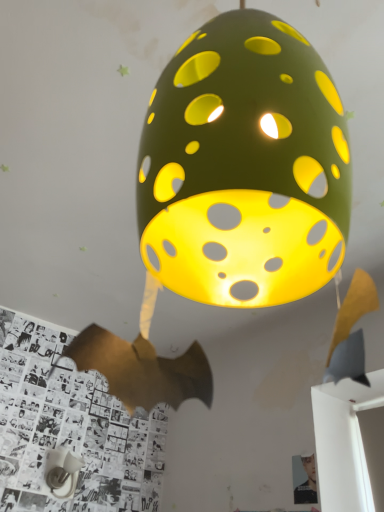
Where is `white matte table lamp at lower left`? The width and height of the screenshot is (384, 512). white matte table lamp at lower left is located at coordinates (62, 471).

What do you see at coordinates (62, 471) in the screenshot? The image size is (384, 512). I see `white matte table lamp at lower left` at bounding box center [62, 471].

You are a GUI agent. You are given a task and a screenshot of the screen. Output one action in this format:
    pyautogui.click(x=<x>, y=<y>)
    Task: Click on the smooth black portrait at lower right
    This screenshot has height=512, width=384.
    Given the screenshot: What is the action you would take?
    pyautogui.click(x=303, y=479)

What do you see at coordinates (303, 479) in the screenshot?
I see `smooth black portrait at lower right` at bounding box center [303, 479].

Identify the location of white matte table lamp at lower left. (62, 471).

Which object is positioned more to the right, white matte table lamp at lower left or smooth black portrait at lower right?

smooth black portrait at lower right is more to the right.

Considering their positions, is white matte table lamp at lower left located in front of or behind smooth black portrait at lower right?

In the image, white matte table lamp at lower left appears behind smooth black portrait at lower right.

Is point (74, 479) less distant than point (310, 473)?

That is False.

From the image's perspective, which one is positioned higher, white matte table lamp at lower left or smooth black portrait at lower right?

smooth black portrait at lower right, from the image's perspective.

From a real-world perspective, which object stands above the other?

white matte table lamp at lower left, from a real-world perspective.

Consider the image. Which of these two, white matte table lamp at lower left or smooth black portrait at lower right, is thinner?

smooth black portrait at lower right.

Which of these two, white matte table lamp at lower left or smooth black portrait at lower right, stands taller?

Standing taller between the two is smooth black portrait at lower right.

Between white matte table lamp at lower left and smooth black portrait at lower right, which one has smaller size?

With smaller size is smooth black portrait at lower right.

Looking at this image, can we say white matte table lamp at lower left lies outside smooth black portrait at lower right?

Absolutely, white matte table lamp at lower left is external to smooth black portrait at lower right.

Would you consider white matte table lamp at lower left to be distant from smooth black portrait at lower right?

No, white matte table lamp at lower left is not far away from smooth black portrait at lower right.

Is white matte table lamp at lower left oriented away from smooth black portrait at lower right?

No, white matte table lamp at lower left's orientation is not away from smooth black portrait at lower right.

Locate an element on the screen. table lamp below the smooth black portrait at lower right (from the image's perspective) is located at coordinates (62, 471).

Which is more to the left, smooth black portrait at lower right or white matte table lamp at lower left?

From the viewer's perspective, white matte table lamp at lower left appears more on the left side.

Relative to white matte table lamp at lower left, is smooth black portrait at lower right in front or behind?

smooth black portrait at lower right is in front of white matte table lamp at lower left.

Is point (302, 496) positioned before point (52, 457)?

Yes, point (302, 496) is closer to viewer.

From the image's perspective, is smooth black portrait at lower right over white matte table lamp at lower left?

Yes, from the image's perspective, smooth black portrait at lower right is over white matte table lamp at lower left.

From the picture: From a real-world perspective, is smooth black portrait at lower right physically above white matte table lamp at lower left?

No.

Considering the sizes of objects smooth black portrait at lower right and white matte table lamp at lower left in the image provided, who is thinner, smooth black portrait at lower right or white matte table lamp at lower left?

smooth black portrait at lower right is thinner.

Is smooth black portrait at lower right taller than white matte table lamp at lower left?

Indeed, smooth black portrait at lower right has a greater height compared to white matte table lamp at lower left.

Who is smaller, smooth black portrait at lower right or white matte table lamp at lower left?

With smaller size is smooth black portrait at lower right.

Is white matte table lamp at lower left inside smooth black portrait at lower right?

No.

Are smooth black portrait at lower right and white matte table lamp at lower left making contact?

They are not placed beside each other.

Is smooth black portrait at lower right facing towards white matte table lamp at lower left?

No, smooth black portrait at lower right is not turned towards white matte table lamp at lower left.

Based on the photo, what's the angular difference between smooth black portrait at lower right and white matte table lamp at lower left's facing directions?

The facing directions of smooth black portrait at lower right and white matte table lamp at lower left are 89.8 degrees apart.

Measure the distance from smooth black portrait at lower right to white matte table lamp at lower left.

The distance of smooth black portrait at lower right from white matte table lamp at lower left is 37.35 inches.

The width and height of the screenshot is (384, 512). I want to click on table lamp that is above the smooth black portrait at lower right (from a real-world perspective), so click(62, 471).

Find the location of a particular element. The width and height of the screenshot is (384, 512). person located on the right of white matte table lamp at lower left is located at coordinates (303, 479).

Identify the location of table lamp behind the smooth black portrait at lower right. (62, 471).